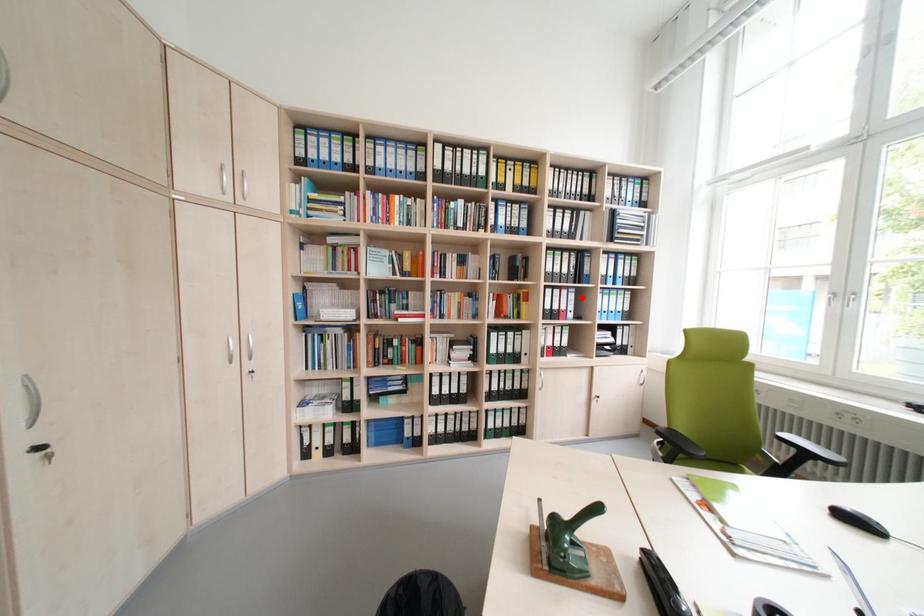
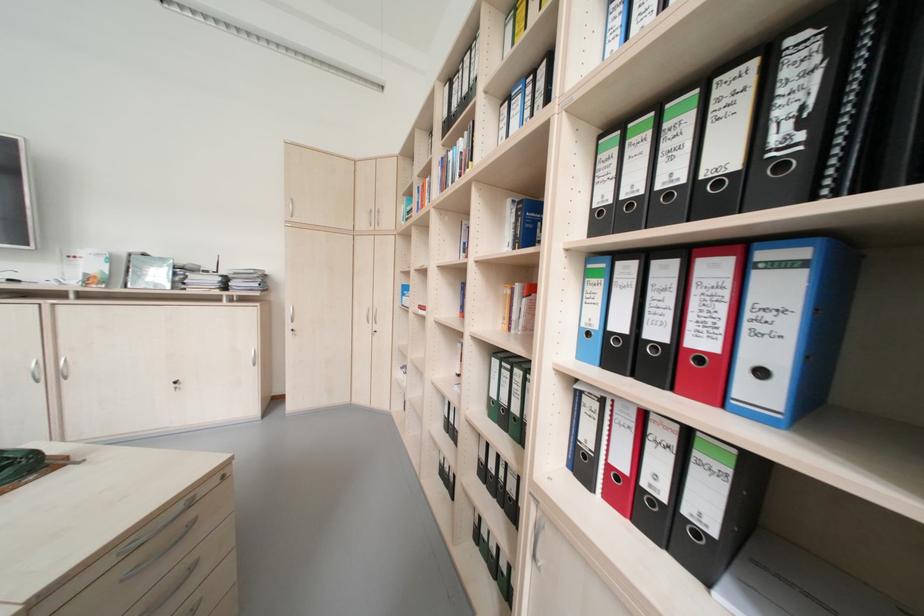
Locate, in the second image, the point that corresponds to the highlighted location in the first image.

(793, 290)